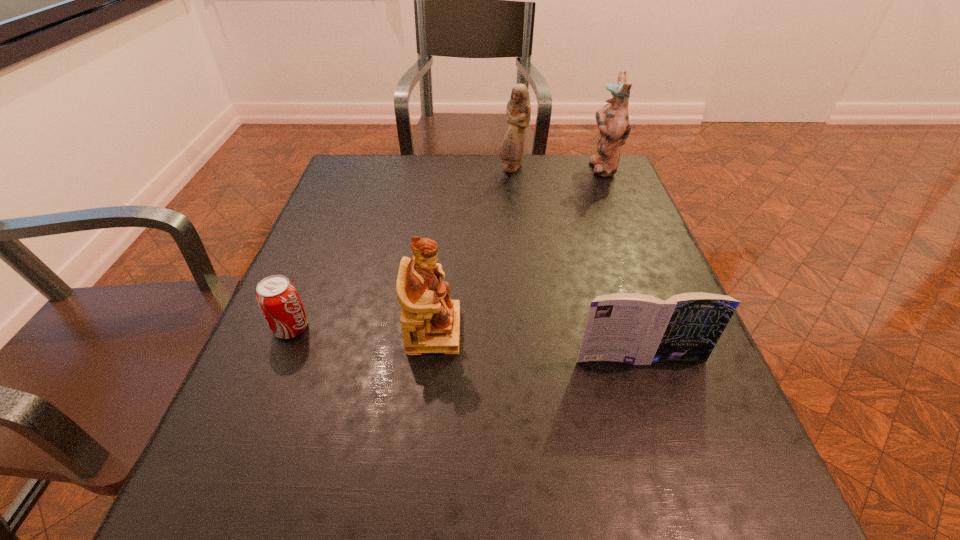
This screenshot has width=960, height=540. In order to click on the rightmost figurine in this screenshot , I will do `click(612, 119)`.

Where is `the third object from right to left`? The image size is (960, 540). the third object from right to left is located at coordinates (518, 112).

The height and width of the screenshot is (540, 960). Identify the location of the second object from left to right. (430, 321).

The image size is (960, 540). I want to click on the nearest figurine, so click(430, 321).

Identify the location of the second shortest object. The image size is (960, 540). pos(639,329).

Identify the location of soda. The image size is (960, 540). (278, 299).

This screenshot has width=960, height=540. I want to click on the leftmost object, so click(278, 299).

Where is `vacant space located 0.100m on the front-facing side of the rightmost figurine`? This screenshot has height=540, width=960. vacant space located 0.100m on the front-facing side of the rightmost figurine is located at coordinates (553, 167).

This screenshot has height=540, width=960. I want to click on vacant area situated 0.220m on the front-facing side of the rightmost figurine, so click(512, 167).

Locate an element on the screen. The image size is (960, 540). free region located on the front-facing side of the rightmost figurine is located at coordinates (536, 167).